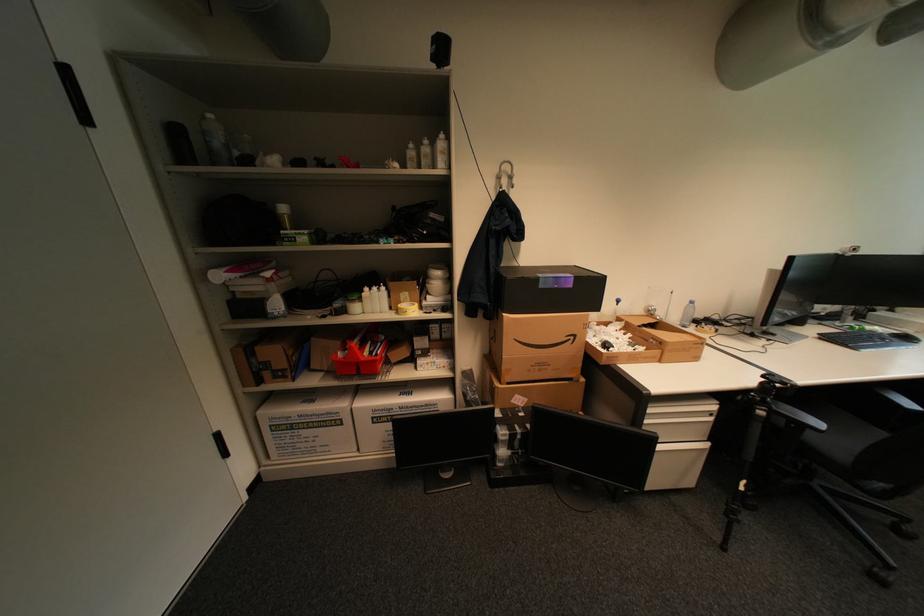
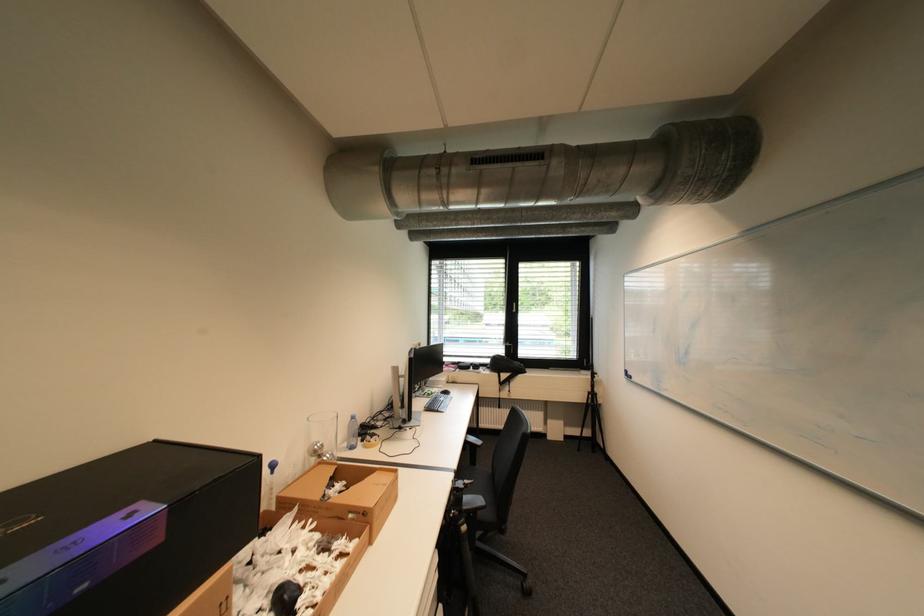
Question: How did the camera likely rotate?

Choices:
 (A) Left
 (B) Right
 (C) Up
 (D) Down

Answer: (B)